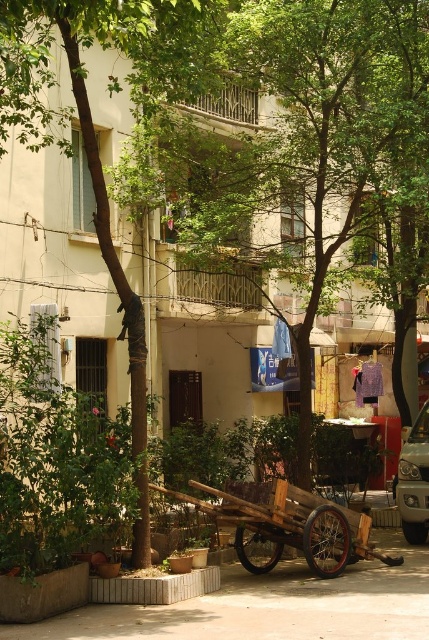
Does green leafy tree at center have a larger size compared to silver metallic car at right?

Incorrect, green leafy tree at center is not larger than silver metallic car at right.

Is green leafy tree at center to the left of silver metallic car at right from the viewer's perspective?

Correct, you'll find green leafy tree at center to the left of silver metallic car at right.

Between point (375, 116) and point (404, 515), which one is positioned in front?

Point (375, 116) is more forward.

The width and height of the screenshot is (429, 640). What are the coordinates of `green leafy tree at center` in the screenshot? It's located at (299, 138).

Is wooden cart at center taller than silver metallic car at right?

No, wooden cart at center is not taller than silver metallic car at right.

Is wooden cart at center in front of silver metallic car at right?

Yes, wooden cart at center is closer to the viewer.

Who is more distant from viewer, (x=250, y=500) or (x=410, y=515)?

The point (x=410, y=515) is more distant.

This screenshot has height=640, width=429. I want to click on wooden cart at center, so click(x=290, y=525).

Does green leafy tree at center have a lesser height compared to wooden cart at center?

Yes.

Can you confirm if green leafy tree at center is positioned to the right of wooden cart at center?

No, green leafy tree at center is not to the right of wooden cart at center.

Image resolution: width=429 pixels, height=640 pixels. Identify the location of green leafy tree at center. (299, 138).

This screenshot has height=640, width=429. I want to click on green leafy tree at center, so click(x=299, y=138).